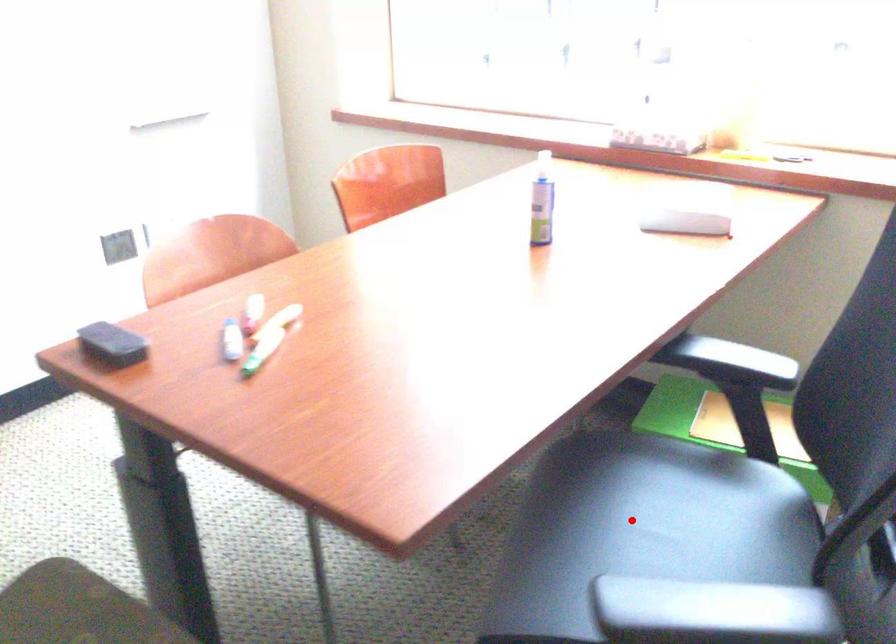
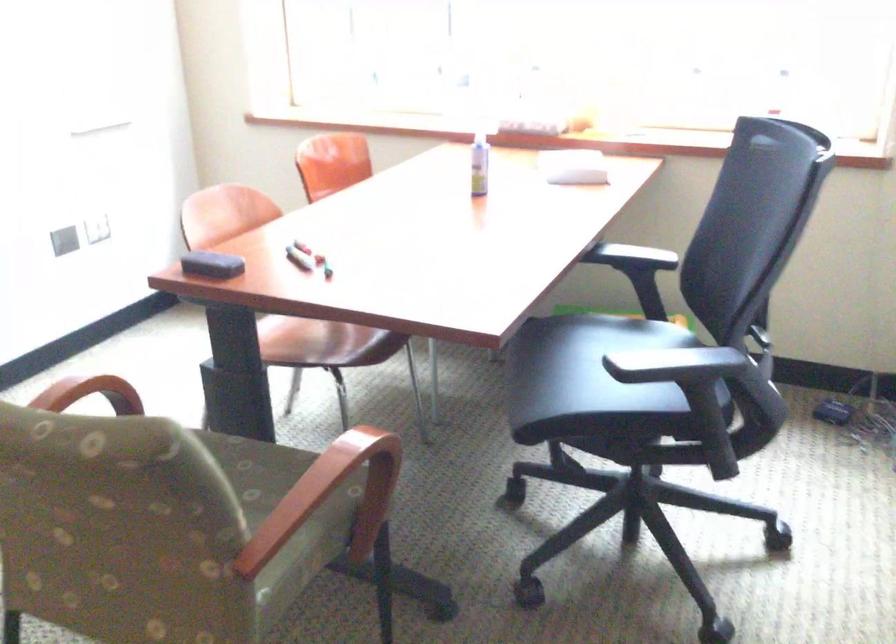
Find the pixel in the second image that matches the highlighted location in the first image.

(591, 361)